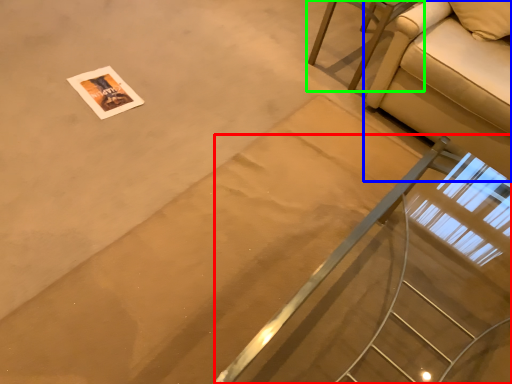
Question: Which object is positioned closest to stairs (highlighted by a red box)? Select from studio couch (highlighted by a blue box) and furniture (highlighted by a green box).

Choices:
 (A) studio couch
 (B) furniture

Answer: (A)